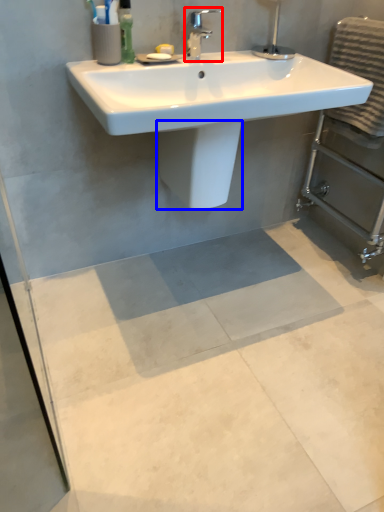
Question: Which of the following is the closest to the observer, tap (highlighted by a red box) or bidet (highlighted by a blue box)?

Choices:
 (A) tap
 (B) bidet

Answer: (A)